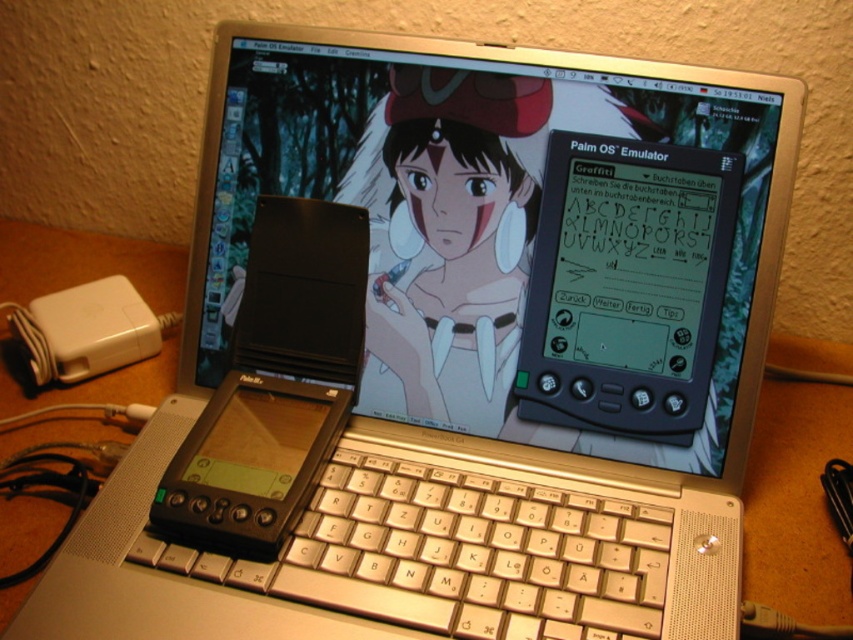
Which is above, black plastic palm pilot at center or white plastic power adapter at lower left?

white plastic power adapter at lower left is higher up.

Who is shorter, black plastic palm pilot at center or white plastic power adapter at lower left?

white plastic power adapter at lower left

Does point (331, 428) come closer to viewer compared to point (129, 348)?

Yes.

The image size is (853, 640). In order to click on black plastic palm pilot at center in this screenshot , I will do `click(274, 385)`.